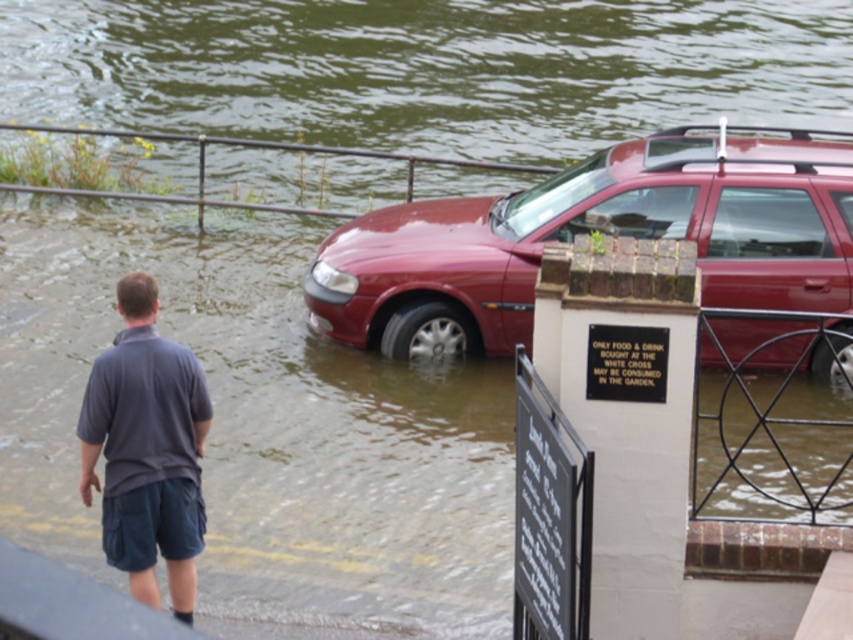
Does point (531, 586) lie in front of point (352, 154)?

Yes.

Is point (548, 468) farther from viewer compared to point (199, 184)?

No, (548, 468) is closer to viewer.

Which is in front, point (524, 529) or point (113, 193)?

Point (524, 529)

Where is `black stone sign at lower right`? The width and height of the screenshot is (853, 640). black stone sign at lower right is located at coordinates (543, 524).

Does shiny red car at center appear under black stone sign at lower right?

Incorrect, shiny red car at center is not positioned below black stone sign at lower right.

In the scene shown: Who is more forward, (805, 188) or (541, 534)?

Point (541, 534)

This screenshot has height=640, width=853. Identify the location of shiny red car at center. (593, 228).

Does dark gray cotton shirt at lower left have a larger size compared to black metal sign at center?

Yes.

Does dark gray cotton shirt at lower left appear on the right side of black metal sign at center?

Incorrect, dark gray cotton shirt at lower left is not on the right side of black metal sign at center.

Which is in front, point (148, 572) or point (628, 355)?

Positioned in front is point (628, 355).

The width and height of the screenshot is (853, 640). What are the coordinates of `dark gray cotton shirt at lower left` in the screenshot? It's located at (146, 449).